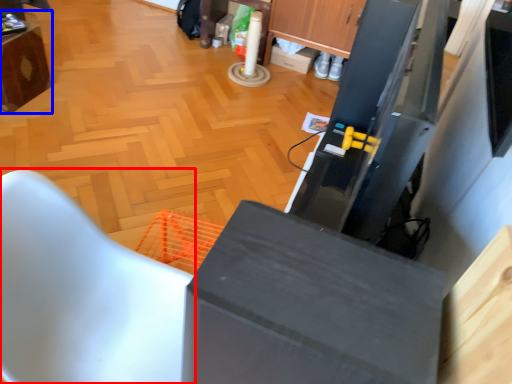
Question: Which object is further to the camera taking this photo, furniture (highlighted by a red box) or furniture (highlighted by a blue box)?

Choices:
 (A) furniture
 (B) furniture

Answer: (B)